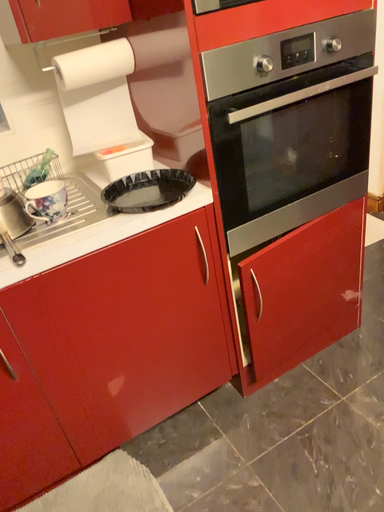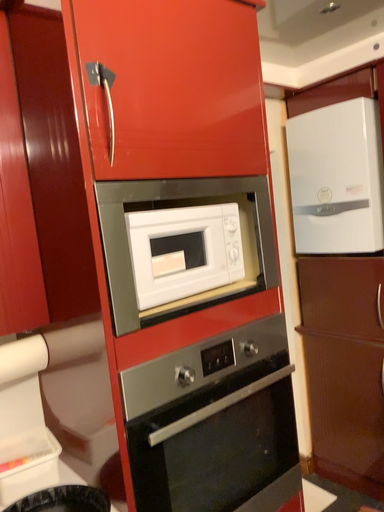
Question: How did the camera likely rotate when shooting the video?

Choices:
 (A) rotated upward
 (B) rotated downward

Answer: (A)